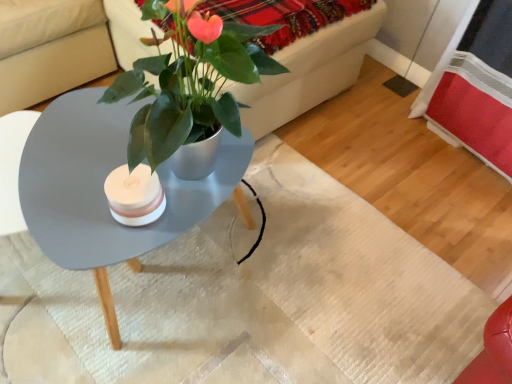
Question: Is velvet red blanket at upper center shorter than matte gray coffee table at center?

Choices:
 (A) yes
 (B) no

Answer: (A)

Question: Is velvet red blanket at upper center with matte gray coffee table at center?

Choices:
 (A) no
 (B) yes

Answer: (A)

Question: Is velvet red blanket at upper center taller than matte gray coffee table at center?

Choices:
 (A) yes
 (B) no

Answer: (B)

Question: Does velvet red blanket at upper center have a larger size compared to matte gray coffee table at center?

Choices:
 (A) no
 (B) yes

Answer: (A)

Question: From the image's perspective, does velvet red blanket at upper center appear lower than matte gray coffee table at center?

Choices:
 (A) yes
 (B) no

Answer: (B)

Question: Is velvet red blanket at upper center in front of matte gray coffee table at center?

Choices:
 (A) no
 (B) yes

Answer: (A)

Question: Does matte gray coffee table at center have a lesser height compared to metallic green plant at center?

Choices:
 (A) yes
 (B) no

Answer: (A)

Question: Is matte gray coffee table at center far away from metallic green plant at center?

Choices:
 (A) no
 (B) yes

Answer: (A)

Question: Does matte gray coffee table at center have a greater height compared to metallic green plant at center?

Choices:
 (A) no
 (B) yes

Answer: (A)

Question: Is matte gray coffee table at center thinner than metallic green plant at center?

Choices:
 (A) no
 (B) yes

Answer: (B)

Question: Does matte gray coffee table at center come behind metallic green plant at center?

Choices:
 (A) no
 (B) yes

Answer: (A)

Question: Is matte gray coffee table at center touching metallic green plant at center?

Choices:
 (A) yes
 (B) no

Answer: (B)

Question: Are metallic green plant at center and matte gray coffee table at center making contact?

Choices:
 (A) yes
 (B) no

Answer: (B)